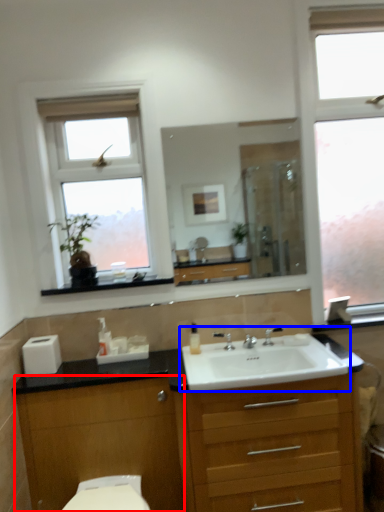
Question: Which object is further to the camera taking this photo, cabinetry (highlighted by a red box) or sink (highlighted by a blue box)?

Choices:
 (A) cabinetry
 (B) sink

Answer: (A)